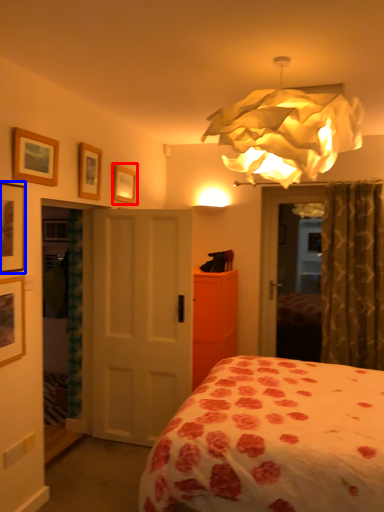
Question: Which object is further to the camera taking this photo, picture frame (highlighted by a red box) or picture frame (highlighted by a blue box)?

Choices:
 (A) picture frame
 (B) picture frame

Answer: (A)